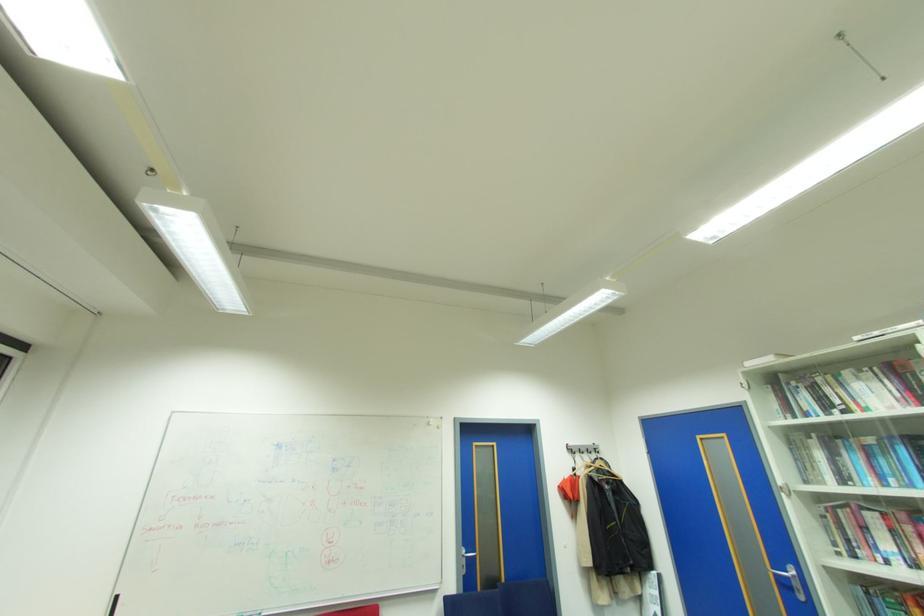
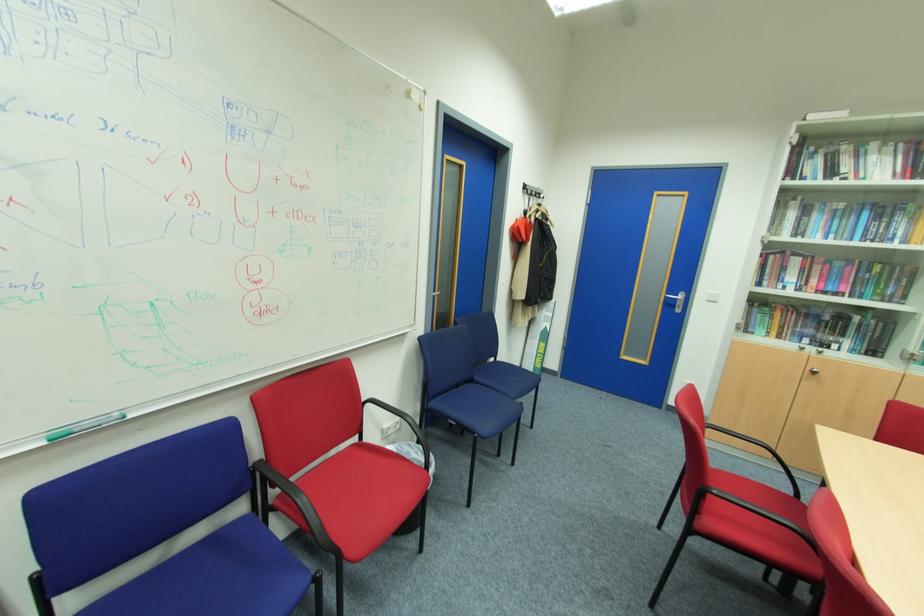
Find the pixel in the second image that matches [779,573] in the first image.

(670, 298)